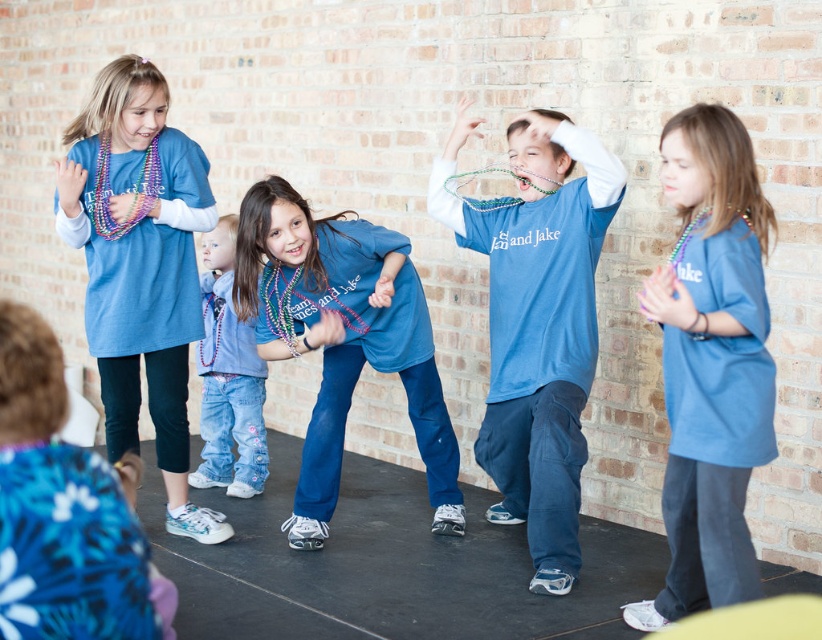
Question: Can you confirm if matte blue shirt at center is bigger than denim jeans at center?

Choices:
 (A) yes
 (B) no

Answer: (A)

Question: Can you confirm if matte blue shirt at center is positioned above matte blue shirt at left?

Choices:
 (A) yes
 (B) no

Answer: (B)

Question: Which object appears farthest from the camera in this image?

Choices:
 (A) matte blue shirt at left
 (B) blue cotton shirt at center
 (C) denim jeans at center
 (D) matte blue shirt at center

Answer: (C)

Question: Which point appears farthest from the camera in this image?

Choices:
 (A) coord(199,419)
 (B) coord(770,452)
 (C) coord(173,435)
 (D) coord(326,294)

Answer: (A)

Question: Which point appears farthest from the camera in this image?

Choices:
 (A) (233, 225)
 (B) (186, 291)

Answer: (A)

Question: Is matte blue shirt at left further to the viewer compared to denim jeans at center?

Choices:
 (A) no
 (B) yes

Answer: (A)